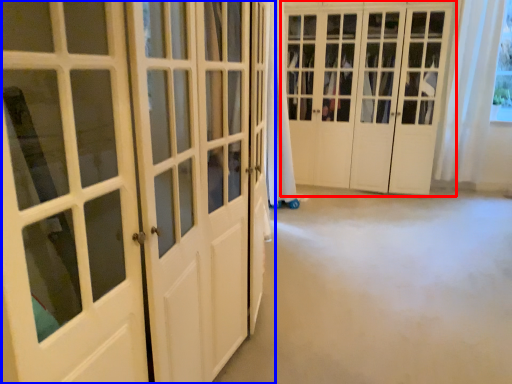
Question: Which point is closer to the camera, door (highlighted by a red box) or door (highlighted by a blue box)?

Choices:
 (A) door
 (B) door

Answer: (B)